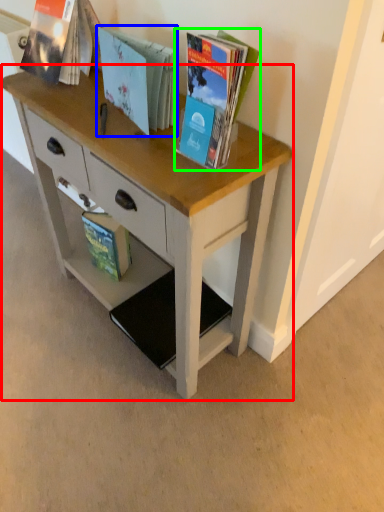
Question: Which is nearer to the desk (highlighted by a red box)? book (highlighted by a blue box) or book (highlighted by a green box).

Choices:
 (A) book
 (B) book

Answer: (A)